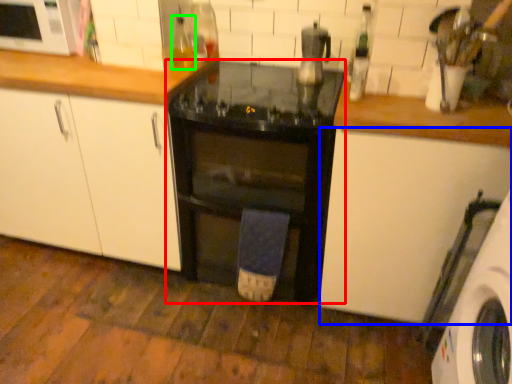
Question: Considering the real-world distances, which object is closest to home appliance (highlighted by a red box)? cabinetry (highlighted by a blue box) or bottle (highlighted by a green box).

Choices:
 (A) cabinetry
 (B) bottle

Answer: (A)